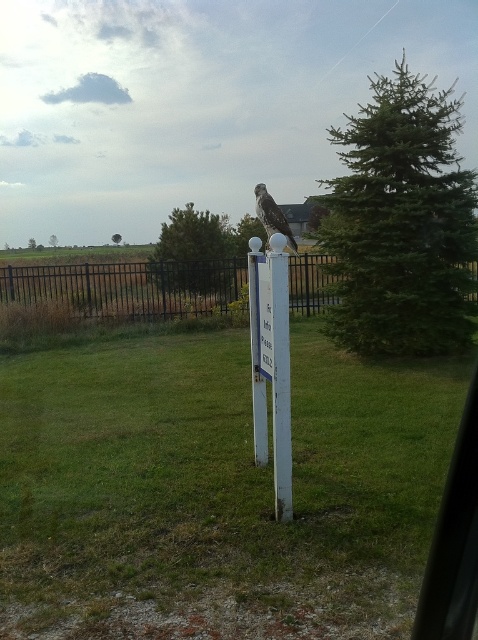
Between point (216, 598) and point (254, 259), which one is positioned in front?

Point (216, 598) is in front.

Based on the photo, can you confirm if green grass at center is smaller than white plastic post at center?

Indeed, green grass at center has a smaller size compared to white plastic post at center.

Is point (379, 468) farther from camera compared to point (258, 426)?

No, it is in front of (258, 426).

Where is `green grass at center`? This screenshot has height=640, width=478. green grass at center is located at coordinates point(217,486).

Is green grass at center above black metal fence at left?

Actually, green grass at center is below black metal fence at left.

Who is more forward, (89, 371) or (56, 268)?

Positioned in front is point (89, 371).

Does point (97, 584) come farther from viewer compared to point (204, 284)?

No, it is not.

Find the location of a particular element. This screenshot has width=478, height=640. green grass at center is located at coordinates (217, 486).

Image resolution: width=478 pixels, height=640 pixels. What do you see at coordinates (217, 486) in the screenshot?
I see `green grass at center` at bounding box center [217, 486].

Which is behind, point (295, 448) or point (267, 216)?

The point (295, 448) is behind.

Where is `green grass at center`? This screenshot has height=640, width=478. green grass at center is located at coordinates (217, 486).